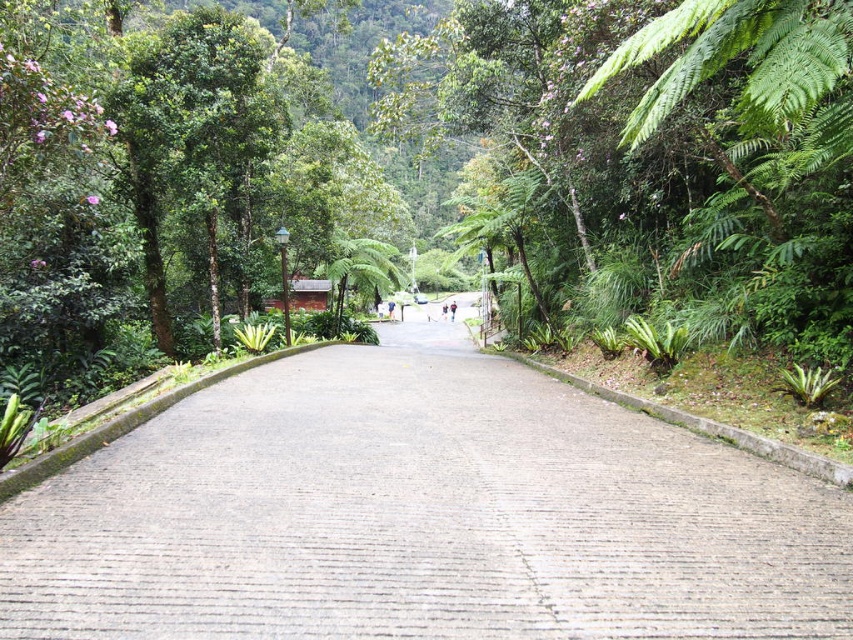
Question: Among these points, which one is farthest from the camera?

Choices:
 (A) (442, 312)
 (B) (454, 301)
 (C) (183, 484)

Answer: (B)

Question: Is gray concrete path at center above blue denim jeans at center?

Choices:
 (A) no
 (B) yes

Answer: (A)

Question: Which object is farther from the camera taking this photo?

Choices:
 (A) blue denim jeans at center
 (B) gray concrete path at center
 (C) light brown skin at center

Answer: (A)

Question: Does gray concrete path at center have a larger size compared to blue denim jeans at center?

Choices:
 (A) yes
 (B) no

Answer: (A)

Question: Does light brown skin at center have a larger size compared to blue denim jeans at center?

Choices:
 (A) no
 (B) yes

Answer: (B)

Question: Which object is the farthest from the gray concrete path at center?

Choices:
 (A) blue denim jeans at center
 (B) light brown skin at center

Answer: (A)